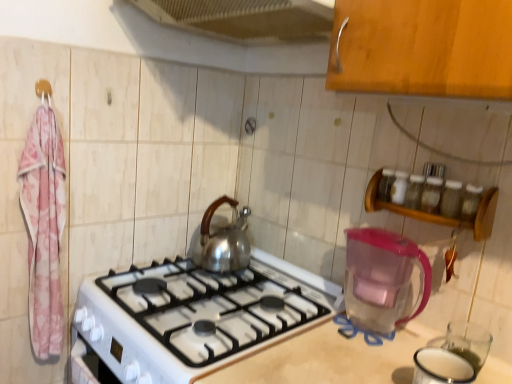
This screenshot has height=384, width=512. Describe the element at coordinates (215, 307) in the screenshot. I see `white glossy gas stove at center` at that location.

Where is `white glossy oven at lower left`? The width and height of the screenshot is (512, 384). white glossy oven at lower left is located at coordinates (89, 366).

Find the location of a particular element. The image size is (512, 384). transparent plastic pitcher at lower right is located at coordinates (382, 278).

You are a GUI agent. You are given a task and a screenshot of the screen. Output one action in this format:
    pyautogui.click(x=<x>, y=<y>)
    Task: Click on the wooden spice rack at upper right
    The width and height of the screenshot is (512, 384).
    Given the screenshot: What is the action you would take?
    pyautogui.click(x=438, y=215)

Image resolution: width=512 pixels, height=384 pixels. I want to click on silver metallic kettle at center, so (223, 240).

Find the location of a particular element. pink fabric towel at left is located at coordinates (44, 229).

Measure the distance between wooden spice rack at upper right and transparent plastic pitcher at lower right.

wooden spice rack at upper right and transparent plastic pitcher at lower right are 6.89 inches apart.

Would you say wooden spice rack at upper right is to the left or to the right of transparent plastic pitcher at lower right in the picture?

In the image, wooden spice rack at upper right appears on the right side of transparent plastic pitcher at lower right.

From the image's perspective, between wooden spice rack at upper right and transparent plastic pitcher at lower right, who is located below?

transparent plastic pitcher at lower right.

Locate an element on the screen. The image size is (512, 384). appliance behind the wooden spice rack at upper right is located at coordinates click(x=382, y=278).

Is transparent plastic pitcher at lower right shorter than white glossy oven at lower left?

Correct, transparent plastic pitcher at lower right is not as tall as white glossy oven at lower left.

Is transparent plastic pitcher at lower right next to white glossy oven at lower left?

No, transparent plastic pitcher at lower right is not beside white glossy oven at lower left.

Considering the positions of points (426, 285) and (104, 368), is point (426, 285) farther from camera compared to point (104, 368)?

No, (426, 285) is closer to viewer.

Which of these two, transparent plastic pitcher at lower right or white glossy oven at lower left, is wider?

Wider between the two is transparent plastic pitcher at lower right.

Is silver metallic kettle at center positioned with its back to white glossy gas stove at center?

silver metallic kettle at center does not have its back to white glossy gas stove at center.

Looking at this image, is silver metallic kettle at center far from white glossy gas stove at center?

silver metallic kettle at center is near white glossy gas stove at center, not far away.

Image resolution: width=512 pixels, height=384 pixels. I want to click on kettle above the white glossy gas stove at center (from the image's perspective), so click(223, 240).

Measure the distance between silver metallic kettle at center and white glossy gas stove at center.

silver metallic kettle at center and white glossy gas stove at center are 7.43 inches apart from each other.

How far apart are transparent plastic pitcher at lower right and silver metallic kettle at center?

48.65 centimeters.

Is transparent plastic pitcher at lower right positioned beyond the bounds of silver metallic kettle at center?

transparent plastic pitcher at lower right is positioned outside silver metallic kettle at center.

Looking at their sizes, would you say transparent plastic pitcher at lower right is wider or thinner than silver metallic kettle at center?

transparent plastic pitcher at lower right is thinner than silver metallic kettle at center.

Is transparent plastic pitcher at lower right aimed at silver metallic kettle at center?

No.

Does point (86, 354) appear closer or farther from the camera than point (160, 302)?

Point (86, 354) is farther from the camera than point (160, 302).

Considering the relative sizes of white glossy oven at lower left and white glossy gas stove at center in the image provided, is white glossy oven at lower left smaller than white glossy gas stove at center?

Yes.

How different are the orientations of white glossy oven at lower left and white glossy gas stove at center in degrees?

The angular difference between white glossy oven at lower left and white glossy gas stove at center is 0.00294 degrees.

From a real-world perspective, which is physically below, white glossy oven at lower left or white glossy gas stove at center?

In real-world perspective, white glossy oven at lower left is lower.

From a real-world perspective, is pink fabric towel at left physically below pink fabric hanger at upper left?

Yes.

Does point (28, 233) come in front of point (44, 93)?

No, it is not.

Is pink fabric towel at left next to pink fabric hanger at upper left?

pink fabric towel at left is not next to pink fabric hanger at upper left, and they're not touching.

Would you say pink fabric hanger at upper left is part of pink fabric towel at left's contents?

Yes, pink fabric towel at left is surrounding pink fabric hanger at upper left.

Where is `appliance behind the white glossy gas stove at center`? Image resolution: width=512 pixels, height=384 pixels. appliance behind the white glossy gas stove at center is located at coordinates (382, 278).

What's the angular difference between white glossy gas stove at center and transparent plastic pitcher at lower right's facing directions?

white glossy gas stove at center and transparent plastic pitcher at lower right are facing 0.00224 degrees away from each other.

Considering the relative sizes of white glossy gas stove at center and transparent plastic pitcher at lower right in the image provided, is white glossy gas stove at center smaller than transparent plastic pitcher at lower right?

No, white glossy gas stove at center is not smaller than transparent plastic pitcher at lower right.

Considering the sizes of objects white glossy gas stove at center and transparent plastic pitcher at lower right in the image provided, who is shorter, white glossy gas stove at center or transparent plastic pitcher at lower right?

white glossy gas stove at center is shorter.

You are a GUI agent. You are given a task and a screenshot of the screen. Output one action in this format:
    pyautogui.click(x=<x>, y=<y>)
    Task: Click on the appliance behind the wooden spice rack at upper right
    The width and height of the screenshot is (512, 384).
    Given the screenshot: What is the action you would take?
    pyautogui.click(x=382, y=278)

Identify the location of appliance above the white glossy oven at lower left (from the image's perspective). (382, 278).

Looking at the image, which one is located further to white glossy gas stove at center, pink fabric hanger at upper left or white glossy oven at lower left?

pink fabric hanger at upper left is positioned further to the anchor white glossy gas stove at center.

From the image, which object appears to be farther from metallic mesh at upper center, wooden spice rack at upper right or white glossy oven at lower left?

white glossy oven at lower left.

Which object lies nearer to the anchor point white glossy oven at lower left, pink fabric hanger at upper left or white glossy gas stove at center?

white glossy gas stove at center is closer to white glossy oven at lower left.

Based on their spatial positions, is white glossy gas stove at center or wooden spice rack at upper right closer to metallic mesh at upper center?

wooden spice rack at upper right is closer to metallic mesh at upper center.

Looking at the image, which one is located closer to wooden spice rack at upper right, metallic mesh at upper center or pink fabric hanger at upper left?

metallic mesh at upper center.

When comparing their distances from white glossy oven at lower left, does metallic mesh at upper center or white glossy gas stove at center seem further?

metallic mesh at upper center lies further to white glossy oven at lower left than the other object.

Which object lies further to the anchor point white glossy oven at lower left, wooden spice rack at upper right or white glossy gas stove at center?

wooden spice rack at upper right is further to white glossy oven at lower left.

When comparing their distances from pink fabric hanger at upper left, does white glossy oven at lower left or white glossy gas stove at center seem further?

Among the two, white glossy oven at lower left is located further to pink fabric hanger at upper left.

The image size is (512, 384). Find the location of `shelf between metallic mesh at upper center and white glossy oven at lower left in the vertical direction`. shelf between metallic mesh at upper center and white glossy oven at lower left in the vertical direction is located at coordinates (438, 215).

This screenshot has height=384, width=512. What are the coordinates of `oven located between pink fabric towel at left and wooden spice rack at upper right in the left-right direction` in the screenshot? It's located at (89, 366).

Find the location of `oven situated between pink fabric hanger at upper left and wooden spice rack at upper right from left to right`. oven situated between pink fabric hanger at upper left and wooden spice rack at upper right from left to right is located at coordinates (89, 366).

Where is `hanger between metallic mesh at upper center and white glossy gas stove at center from top to bottom`? The width and height of the screenshot is (512, 384). hanger between metallic mesh at upper center and white glossy gas stove at center from top to bottom is located at coordinates (42, 90).